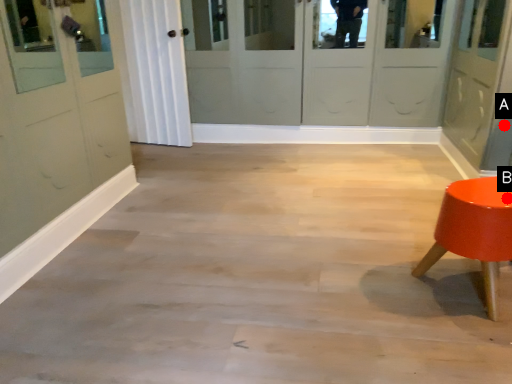
Question: Two points are circled on the image, labeled by A and B beside each circle. Which of the following is the farthest from the observer?

Choices:
 (A) A is further
 (B) B is further

Answer: (A)